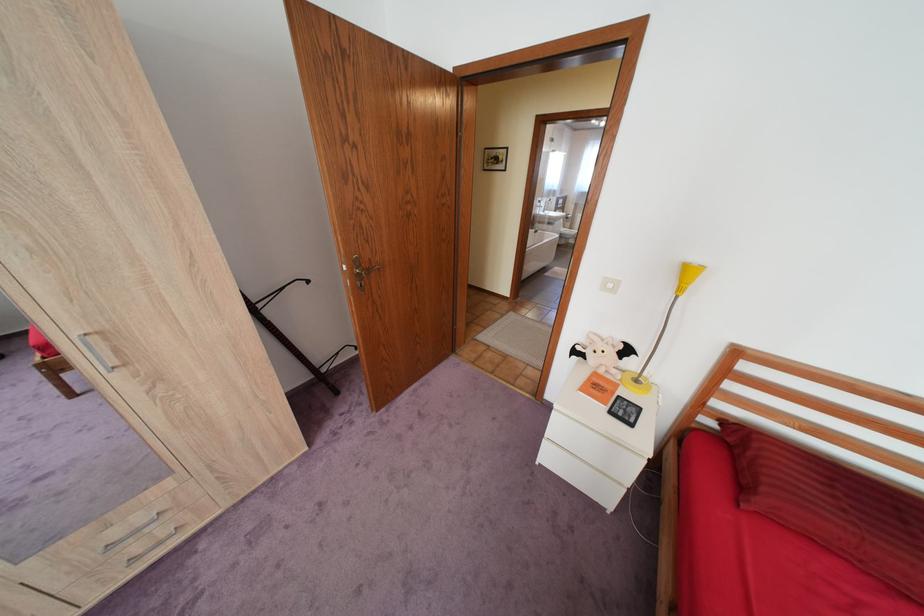
Locate an element on the screen. This screenshot has height=616, width=924. small electronic device is located at coordinates (624, 411).